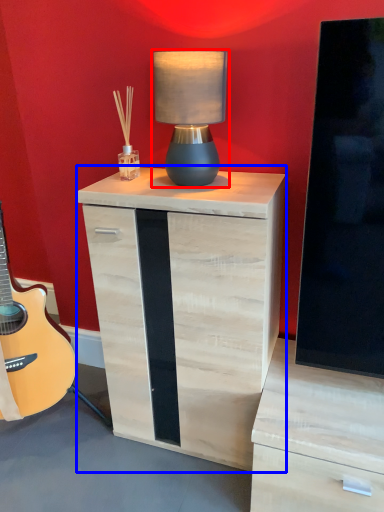
Question: Among these objects, which one is nearest to the camera, table lamp (highlighted by a red box) or nightstand (highlighted by a blue box)?

Choices:
 (A) table lamp
 (B) nightstand

Answer: (A)